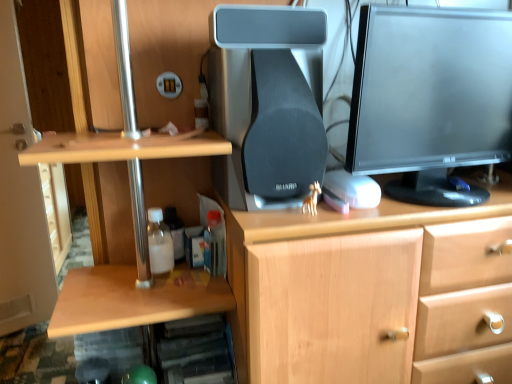
How much space does translucent plastic bottle at lower left, arranged as the 2th bottle when viewed from the right, occupy vertically?

It is 5.91 inches.

What do you see at coordinates (430, 99) in the screenshot? I see `matte black monitor at upper right` at bounding box center [430, 99].

Identify the location of translucent plastic bottle at lower left, arranged as the 2th bottle when viewed from the right. (159, 243).

Considering the positions of objects black matte speaker at center and matte black monitor at upper right in the image provided, who is behind, black matte speaker at center or matte black monitor at upper right?

black matte speaker at center is further from the camera.

Is black matte speaker at center in contact with matte black monitor at upper right?

No, black matte speaker at center is not making contact with matte black monitor at upper right.

Which is behind, point (277, 173) or point (496, 43)?

The point (496, 43) is farther from the camera.

Locate an element on the screen. This screenshot has width=512, height=384. bottle above the translucent plastic bottle at lower center, acting as the second bottle starting from the left (from a real-world perspective) is located at coordinates (159, 243).

Is the position of translucent plastic bottle at lower left, arranged as the 1th bottle when viewed from the left, less distant than that of translucent plastic bottle at lower center, the first bottle viewed from the right?

Yes, translucent plastic bottle at lower left, arranged as the 1th bottle when viewed from the left, is closer to the viewer.

Which is closer to the camera, (173, 258) or (215, 226)?

Point (173, 258) appears to be closer to the viewer than point (215, 226).

Looking at this image, is translucent plastic bottle at lower left, arranged as the 2th bottle when viewed from the right, not within translucent plastic bottle at lower center, acting as the second bottle starting from the left?

translucent plastic bottle at lower left, arranged as the 2th bottle when viewed from the right, is positioned outside translucent plastic bottle at lower center, acting as the second bottle starting from the left.

Which is in front, translucent plastic bottle at lower center, acting as the second bottle starting from the left, or translucent plastic bottle at lower left, arranged as the 1th bottle when viewed from the left?

Positioned in front is translucent plastic bottle at lower left, arranged as the 1th bottle when viewed from the left.

Is translucent plastic bottle at lower left, arranged as the 1th bottle when viewed from the left, located within translucent plastic bottle at lower center, acting as the second bottle starting from the left?

No.

Is translucent plastic bottle at lower center, acting as the second bottle starting from the left, wider or thinner than translucent plastic bottle at lower left, arranged as the 2th bottle when viewed from the right?

Considering their sizes, translucent plastic bottle at lower center, acting as the second bottle starting from the left, looks slimmer than translucent plastic bottle at lower left, arranged as the 2th bottle when viewed from the right.

Consider the image. Which object is further away from the camera taking this photo, black matte speaker at center or translucent plastic bottle at lower center, acting as the second bottle starting from the left?

Positioned behind is translucent plastic bottle at lower center, acting as the second bottle starting from the left.

Looking at this image, considering the sizes of objects black matte speaker at center and translucent plastic bottle at lower center, acting as the second bottle starting from the left, in the image provided, who is smaller, black matte speaker at center or translucent plastic bottle at lower center, acting as the second bottle starting from the left,?

translucent plastic bottle at lower center, acting as the second bottle starting from the left.

In terms of height, does black matte speaker at center look taller or shorter compared to translucent plastic bottle at lower center, acting as the second bottle starting from the left?

black matte speaker at center is taller than translucent plastic bottle at lower center, acting as the second bottle starting from the left.

What's the angular difference between translucent plastic bottle at lower left, arranged as the 2th bottle when viewed from the right, and black matte speaker at center's facing directions?

There is a 2.09-degree angle between the facing directions of translucent plastic bottle at lower left, arranged as the 2th bottle when viewed from the right, and black matte speaker at center.

From the image's perspective, is translucent plastic bottle at lower left, arranged as the 2th bottle when viewed from the right, over black matte speaker at center?

Actually, translucent plastic bottle at lower left, arranged as the 2th bottle when viewed from the right, appears below black matte speaker at center in the image.

Based on the photo, is translucent plastic bottle at lower left, arranged as the 2th bottle when viewed from the right, inside or outside of black matte speaker at center?

translucent plastic bottle at lower left, arranged as the 2th bottle when viewed from the right, is located beyond the bounds of black matte speaker at center.

Is matte black monitor at upper right positioned far away from translucent plastic bottle at lower left, arranged as the 1th bottle when viewed from the left?

No, matte black monitor at upper right is not far from translucent plastic bottle at lower left, arranged as the 1th bottle when viewed from the left.

Does point (397, 12) lie in front of point (158, 241)?

That is True.

Who is taller, matte black monitor at upper right or translucent plastic bottle at lower left, arranged as the 1th bottle when viewed from the left?

Standing taller between the two is matte black monitor at upper right.

Is matte black monitor at upper right not within translucent plastic bottle at lower left, arranged as the 2th bottle when viewed from the right?

Yes, matte black monitor at upper right is outside of translucent plastic bottle at lower left, arranged as the 2th bottle when viewed from the right.

Is point (219, 229) closer to camera compared to point (440, 144)?

No, (219, 229) is further to viewer.

Can you tell me how much translucent plastic bottle at lower center, the first bottle viewed from the right, and matte black monitor at upper right differ in facing direction?

They differ by 5.79 degrees in their facing directions.

Is translucent plastic bottle at lower center, the first bottle viewed from the right, turned away from matte black monitor at upper right?

No, matte black monitor at upper right is not at the back of translucent plastic bottle at lower center, the first bottle viewed from the right.

In the image, there is a matte black monitor at upper right. Identify the location of desktop computer below it (from a real-world perspective). (267, 103).

Where is `bottle positioned vertically above the translucent plastic bottle at lower center, the first bottle viewed from the right (from a real-world perspective)`? bottle positioned vertically above the translucent plastic bottle at lower center, the first bottle viewed from the right (from a real-world perspective) is located at coordinates (159, 243).

Which object lies nearer to the anchor point matte black monitor at upper right, black matte speaker at center or translucent plastic bottle at lower center, the first bottle viewed from the right?

Based on the image, black matte speaker at center appears to be nearer to matte black monitor at upper right.

When comparing their distances from translucent plastic bottle at lower center, the first bottle viewed from the right, does translucent plastic bottle at lower left, arranged as the 2th bottle when viewed from the right, or matte black monitor at upper right seem further?

matte black monitor at upper right.

Estimate the real-world distances between objects in this image. Which object is further from matte black monitor at upper right, translucent plastic bottle at lower left, arranged as the 2th bottle when viewed from the right, or black matte speaker at center?

Among the two, translucent plastic bottle at lower left, arranged as the 2th bottle when viewed from the right, is located further to matte black monitor at upper right.

From the picture: Considering their positions, is matte black monitor at upper right positioned further to translucent plastic bottle at lower left, arranged as the 2th bottle when viewed from the right, than translucent plastic bottle at lower center, acting as the second bottle starting from the left?

matte black monitor at upper right is positioned further to the anchor translucent plastic bottle at lower left, arranged as the 2th bottle when viewed from the right.

From the picture: Looking at the image, which one is located closer to matte black monitor at upper right, translucent plastic bottle at lower center, acting as the second bottle starting from the left, or black matte speaker at center?

Among the two, black matte speaker at center is located nearer to matte black monitor at upper right.

Which object lies nearer to the anchor point translucent plastic bottle at lower left, arranged as the 2th bottle when viewed from the right, black matte speaker at center or translucent plastic bottle at lower center, the first bottle viewed from the right?

Among the two, translucent plastic bottle at lower center, the first bottle viewed from the right, is located nearer to translucent plastic bottle at lower left, arranged as the 2th bottle when viewed from the right.

Considering their positions, is black matte speaker at center positioned further to translucent plastic bottle at lower left, arranged as the 2th bottle when viewed from the right, than matte black monitor at upper right?

Among the two, matte black monitor at upper right is located further to translucent plastic bottle at lower left, arranged as the 2th bottle when viewed from the right.

Looking at the image, which one is located further to translucent plastic bottle at lower left, arranged as the 1th bottle when viewed from the left, translucent plastic bottle at lower center, acting as the second bottle starting from the left, or matte black monitor at upper right?

matte black monitor at upper right.

The image size is (512, 384). Identify the location of bottle between translucent plastic bottle at lower left, arranged as the 1th bottle when viewed from the left, and matte black monitor at upper right, in the horizontal direction. (214, 245).

Where is `desktop computer situated between translucent plastic bottle at lower center, acting as the second bottle starting from the left, and matte black monitor at upper right from left to right`? desktop computer situated between translucent plastic bottle at lower center, acting as the second bottle starting from the left, and matte black monitor at upper right from left to right is located at coordinates (267, 103).

The image size is (512, 384). In order to click on bottle that lies between black matte speaker at center and translucent plastic bottle at lower center, acting as the second bottle starting from the left, from top to bottom in this screenshot , I will do `click(159, 243)`.

At what (x,y) coordinates should I click in order to perform the action: click on desktop computer between translucent plastic bottle at lower left, arranged as the 1th bottle when viewed from the left, and matte black monitor at upper right. Please return your answer as a coordinate pair (x, y). This screenshot has height=384, width=512. Looking at the image, I should click on tap(267, 103).